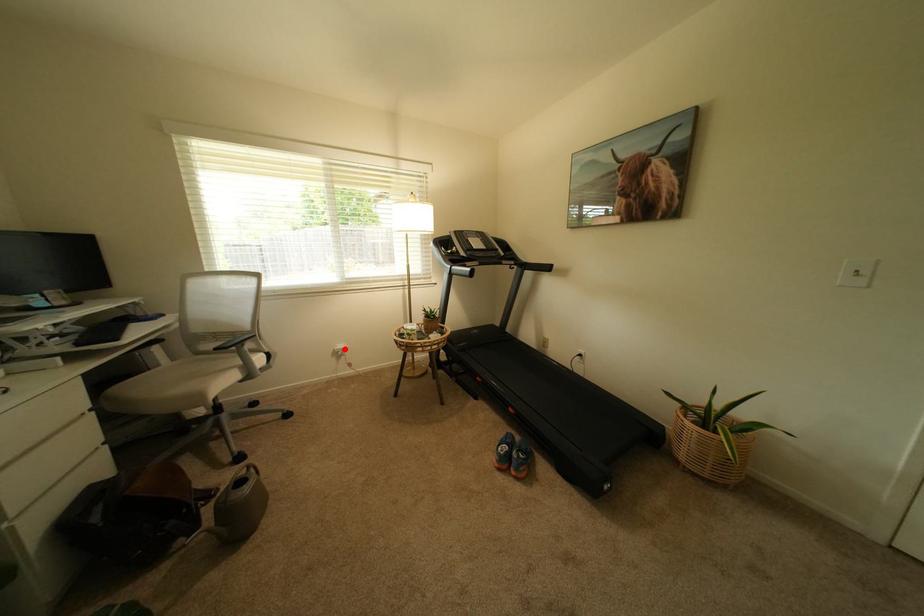
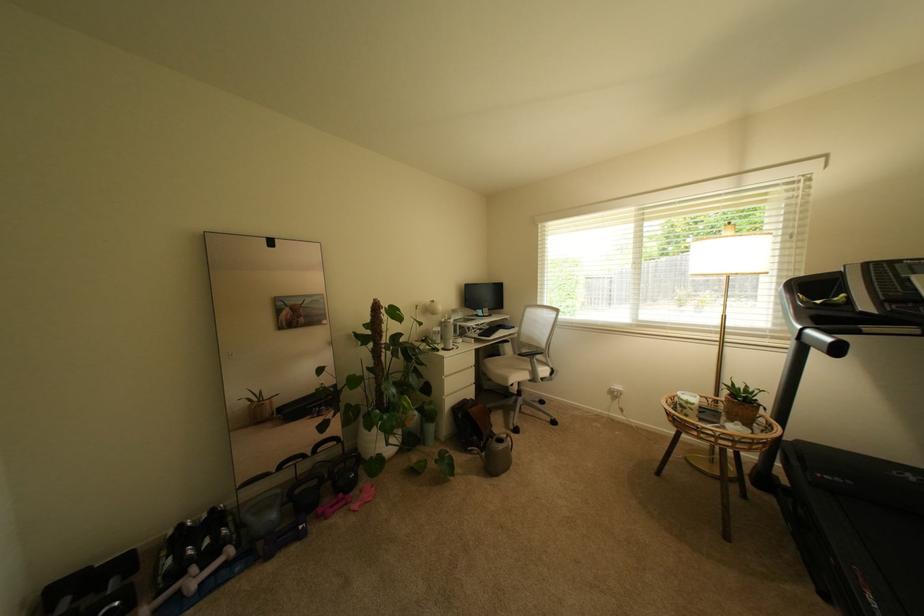
The point at the highlighted location is marked in the first image. Where is the corresponding point in the second image?

(622, 389)